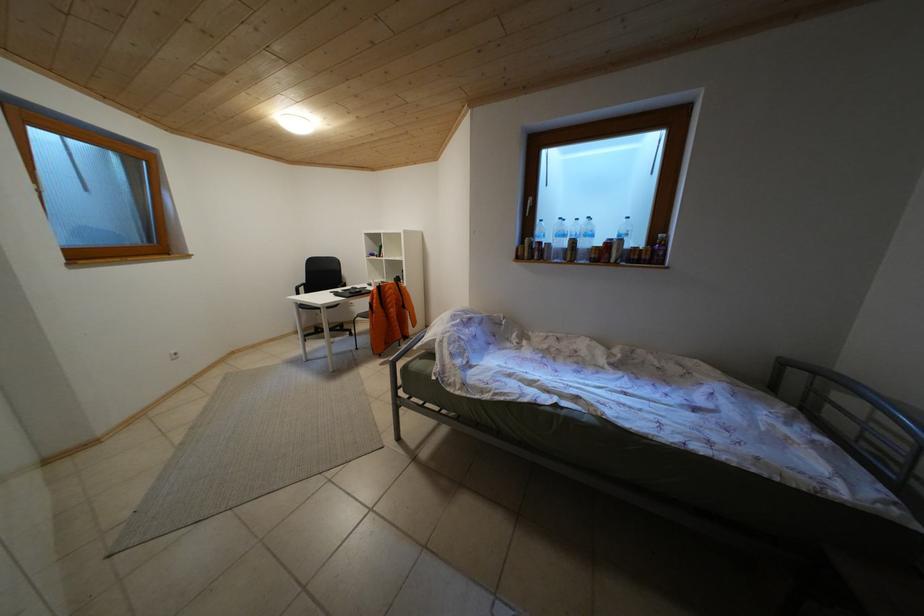
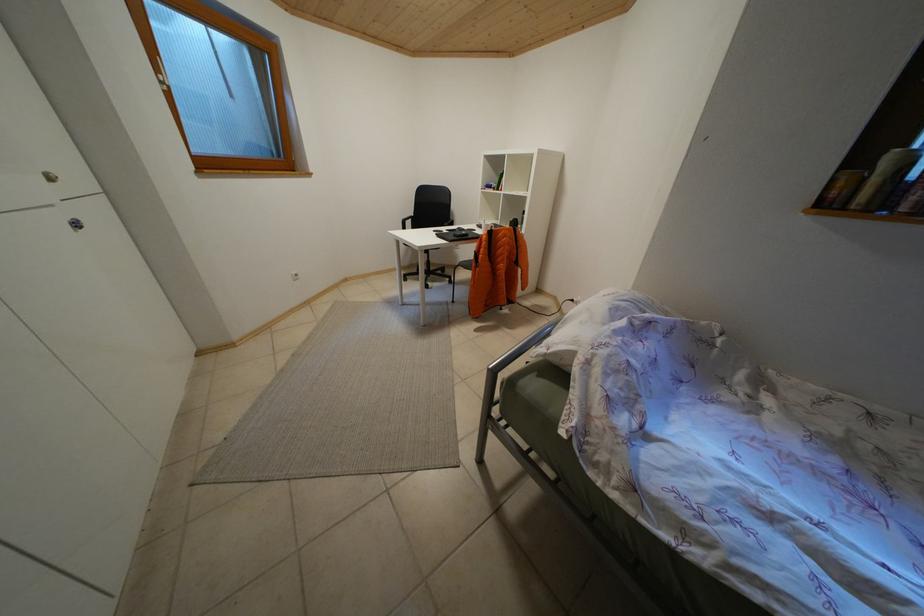
The images are taken continuously from a first-person perspective. In which direction are you moving?

The cameraman walked toward left, forward.